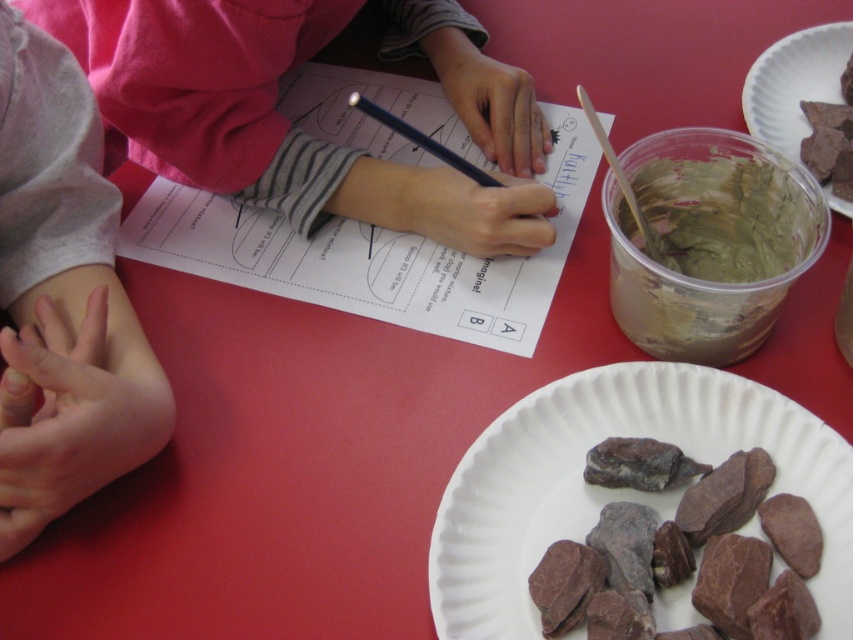
Which of these two, matte pink shirt at upper left or brown matte paper plate at upper right, stands shorter?

brown matte paper plate at upper right

Based on the photo, between matte pink shirt at upper left and brown matte paper plate at upper right, which one has more height?

With more height is matte pink shirt at upper left.

Image resolution: width=853 pixels, height=640 pixels. Find the location of `matte pink shirt at upper left`. matte pink shirt at upper left is located at coordinates (300, 131).

The height and width of the screenshot is (640, 853). In order to click on matte pink shirt at upper left in this screenshot , I will do `click(300, 131)`.

Is matte pink shirt at upper left shorter than green clay paste at upper right?

Incorrect, matte pink shirt at upper left's height does not fall short of green clay paste at upper right's.

Between matte pink shirt at upper left and green clay paste at upper right, which one has more height?

With more height is matte pink shirt at upper left.

Is point (149, 0) positioned before point (728, 289)?

No, it is not.

Locate an element on the screen. The image size is (853, 640). matte pink shirt at upper left is located at coordinates (300, 131).

Locate an element on the screen. This screenshot has height=640, width=853. green clay paste at upper right is located at coordinates (711, 241).

Is point (740, 304) positioned after point (786, 145)?

No, (740, 304) is closer to viewer.

Between point (674, 291) and point (788, 156), which one is positioned behind?

Positioned behind is point (788, 156).

You are a GUI agent. You are given a task and a screenshot of the screen. Output one action in this format:
    pyautogui.click(x=<x>, y=<y>)
    Task: Click on the green clay paste at upper right
    
    Given the screenshot: What is the action you would take?
    pyautogui.click(x=711, y=241)